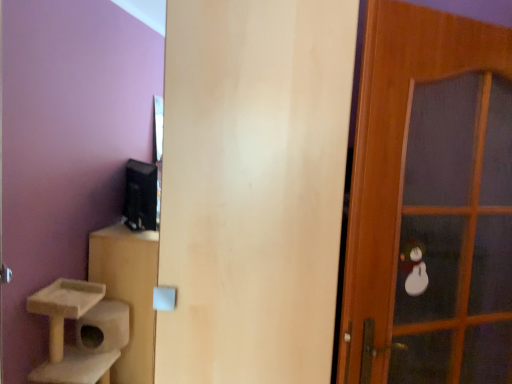
This screenshot has height=384, width=512. Identify the location of wooden door at right, positioned as the 2th door in left-to-right order. (430, 203).

This screenshot has height=384, width=512. What do you see at coordinates (430, 203) in the screenshot?
I see `wooden door at right, positioned as the 2th door in left-to-right order` at bounding box center [430, 203].

Image resolution: width=512 pixels, height=384 pixels. What do you see at coordinates (253, 187) in the screenshot?
I see `matte wood door at center, acting as the first door starting from the left` at bounding box center [253, 187].

What is the approximate height of matte wood door at center, acting as the first door starting from the left?

It is 1.85 meters.

You are a GUI agent. You are given a task and a screenshot of the screen. Output one action in this format:
    pyautogui.click(x=<x>, y=<y>)
    Task: Click on the matte wood door at center, which appears as the 2th door when viewed from the right
    The width and height of the screenshot is (512, 384).
    Given the screenshot: What is the action you would take?
    pyautogui.click(x=253, y=187)

Where is `wooden door at right, which is counted as the first door, starting from the right`? The height and width of the screenshot is (384, 512). wooden door at right, which is counted as the first door, starting from the right is located at coordinates (430, 203).

Between wooden door at right, which is counted as the first door, starting from the right, and matte wood door at center, acting as the first door starting from the left, which one appears on the left side from the viewer's perspective?

matte wood door at center, acting as the first door starting from the left, is more to the left.

Is wooden door at right, which is counted as the first door, starting from the right, in front of or behind matte wood door at center, acting as the first door starting from the left, in the image?

Visually, wooden door at right, which is counted as the first door, starting from the right, is located behind matte wood door at center, acting as the first door starting from the left.

Which is in front, point (386, 25) or point (194, 95)?

The point (386, 25) is closer.

From the image's perspective, is wooden door at right, which is counted as the first door, starting from the right, on matte wood door at center, acting as the first door starting from the left?

Yes, from the image's perspective, wooden door at right, which is counted as the first door, starting from the right, is on top of matte wood door at center, acting as the first door starting from the left.

From a real-world perspective, which is physically below, wooden door at right, which is counted as the first door, starting from the right, or matte wood door at center, acting as the first door starting from the left?

From a 3D spatial view, matte wood door at center, acting as the first door starting from the left, is below.

Can you confirm if wooden door at right, which is counted as the first door, starting from the right, is wider than matte wood door at center, which appears as the 2th door when viewed from the right?

In fact, wooden door at right, which is counted as the first door, starting from the right, might be narrower than matte wood door at center, which appears as the 2th door when viewed from the right.

Is wooden door at right, positioned as the 2th door in left-to-right order, shorter than matte wood door at center, which appears as the 2th door when viewed from the right?

Yes, wooden door at right, positioned as the 2th door in left-to-right order, is shorter than matte wood door at center, which appears as the 2th door when viewed from the right.

Is wooden door at right, positioned as the 2th door in left-to-right order, bigger or smaller than matte wood door at center, acting as the first door starting from the left?

Clearly, wooden door at right, positioned as the 2th door in left-to-right order, is smaller in size than matte wood door at center, acting as the first door starting from the left.

Is wooden door at right, positioned as the 2th door in left-to-right order, located outside matte wood door at center, acting as the first door starting from the left?

wooden door at right, positioned as the 2th door in left-to-right order, lies outside matte wood door at center, acting as the first door starting from the left,'s area.

Can you see wooden door at right, positioned as the 2th door in left-to-right order, touching matte wood door at center, which appears as the 2th door when viewed from the right?

wooden door at right, positioned as the 2th door in left-to-right order, is not next to matte wood door at center, which appears as the 2th door when viewed from the right, and they're not touching.

Is wooden door at right, which is counted as the first door, starting from the right, turned away from matte wood door at center, which appears as the 2th door when viewed from the right?

wooden door at right, which is counted as the first door, starting from the right, is not turned away from matte wood door at center, which appears as the 2th door when viewed from the right.

Consider the image. Could you measure the distance between wooden door at right, which is counted as the first door, starting from the right, and matte wood door at center, acting as the first door starting from the left?

wooden door at right, which is counted as the first door, starting from the right, is 15.22 inches from matte wood door at center, acting as the first door starting from the left.

Find the location of a particular element. Image resolution: width=512 pixels, height=384 pixels. door located above the matte wood door at center, which appears as the 2th door when viewed from the right (from the image's perspective) is located at coordinates (430, 203).

Which is more to the left, matte wood door at center, acting as the first door starting from the left, or wooden door at right, positioned as the 2th door in left-to-right order?

From the viewer's perspective, matte wood door at center, acting as the first door starting from the left, appears more on the left side.

Does matte wood door at center, which appears as the 2th door when viewed from the right, lie in front of wooden door at right, positioned as the 2th door in left-to-right order?

That is True.

Which is farther from the camera, (309,340) or (452,272)?

Point (452,272)

From the image's perspective, which one is positioned higher, matte wood door at center, acting as the first door starting from the left, or wooden door at right, positioned as the 2th door in left-to-right order?

wooden door at right, positioned as the 2th door in left-to-right order, appears higher in the image.

From a real-world perspective, does matte wood door at center, acting as the first door starting from the left, stand above wooden door at right, which is counted as the first door, starting from the right?

Incorrect, from a real-world perspective, matte wood door at center, acting as the first door starting from the left, is lower than wooden door at right, which is counted as the first door, starting from the right.

Considering the relative sizes of matte wood door at center, which appears as the 2th door when viewed from the right, and wooden door at right, which is counted as the first door, starting from the right, in the image provided, is matte wood door at center, which appears as the 2th door when viewed from the right, wider than wooden door at right, which is counted as the first door, starting from the right,?

Yes, matte wood door at center, which appears as the 2th door when viewed from the right, is wider than wooden door at right, which is counted as the first door, starting from the right.

Considering the relative sizes of matte wood door at center, acting as the first door starting from the left, and wooden door at right, which is counted as the first door, starting from the right, in the image provided, is matte wood door at center, acting as the first door starting from the left, taller than wooden door at right, which is counted as the first door, starting from the right,?

Yes.

Consider the image. Between matte wood door at center, which appears as the 2th door when viewed from the right, and wooden door at right, which is counted as the first door, starting from the right, which one has smaller size?

wooden door at right, which is counted as the first door, starting from the right, is smaller.

Is wooden door at right, positioned as the 2th door in left-to-right order, located within matte wood door at center, which appears as the 2th door when viewed from the right?

No, wooden door at right, positioned as the 2th door in left-to-right order, is not surrounded by matte wood door at center, which appears as the 2th door when viewed from the right.

Is the surface of matte wood door at center, which appears as the 2th door when viewed from the right, in direct contact with wooden door at right, positioned as the 2th door in left-to-right order?

They are not placed beside each other.

Is matte wood door at center, acting as the first door starting from the left, facing towards wooden door at right, which is counted as the first door, starting from the right?

No.

Can you tell me how much matte wood door at center, which appears as the 2th door when viewed from the right, and wooden door at right, positioned as the 2th door in left-to-right order, differ in facing direction?

The angular difference between matte wood door at center, which appears as the 2th door when viewed from the right, and wooden door at right, positioned as the 2th door in left-to-right order, is 32.1 degrees.

You are a GUI agent. You are given a task and a screenshot of the screen. Output one action in this format:
    pyautogui.click(x=<x>, y=<y>)
    Task: Click on the door to the right of matte wood door at center, acting as the first door starting from the left
    The width and height of the screenshot is (512, 384).
    Given the screenshot: What is the action you would take?
    pyautogui.click(x=430, y=203)

In the image, there is a wooden door at right, which is counted as the first door, starting from the right. At what (x,y) coordinates should I click in order to perform the action: click on door below it (from the image's perspective). Please return your answer as a coordinate pair (x, y). Looking at the image, I should click on (253, 187).

Locate an element on the screen. The width and height of the screenshot is (512, 384). door that is above the matte wood door at center, which appears as the 2th door when viewed from the right (from a real-world perspective) is located at coordinates (430, 203).